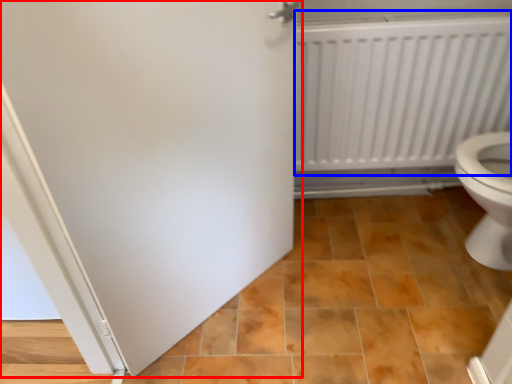
Question: Which object is closer to the camera taking this photo, door (highlighted by a red box) or radiator (highlighted by a blue box)?

Choices:
 (A) door
 (B) radiator

Answer: (A)